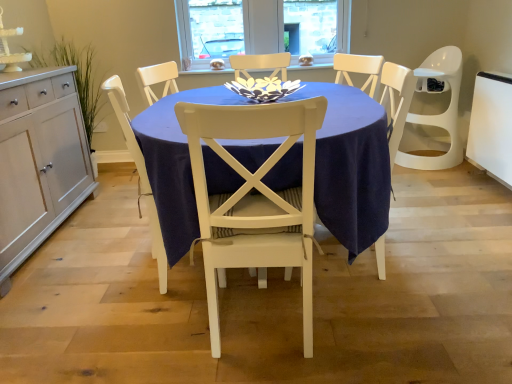
What is the approximate width of white painted wood chair at center, the first chair positioned from the right?

white painted wood chair at center, the first chair positioned from the right, is 21.41 inches in width.

In order to face white painted wood chair at center, the first chair positioned from the right, should I rotate leftwards or rightwards?

Turn left approximately 0.170 degrees to face it.

The height and width of the screenshot is (384, 512). What do you see at coordinates (139, 173) in the screenshot? I see `white wood chair at center, acting as the first chair starting from the left` at bounding box center [139, 173].

What do you see at coordinates (39, 161) in the screenshot? I see `white wood cabinet at left` at bounding box center [39, 161].

Find the location of `white painted wood chair at center, which is counted as the 2th chair, starting from the left`. white painted wood chair at center, which is counted as the 2th chair, starting from the left is located at coordinates (255, 197).

From a real-world perspective, is white painted wood chair at center, the first chair positioned from the right, below navy blue fabric table at center?

No, from a real-world perspective, white painted wood chair at center, the first chair positioned from the right, is not below navy blue fabric table at center.

Based on the photo, in the image, is white painted wood chair at center, the first chair positioned from the right, on the left side or the right side of navy blue fabric table at center?

white painted wood chair at center, the first chair positioned from the right, is positioned on navy blue fabric table at center's left side.

Does white painted wood chair at center, which is counted as the 2th chair, starting from the left, have a lesser height compared to navy blue fabric table at center?

No, white painted wood chair at center, which is counted as the 2th chair, starting from the left, is not shorter than navy blue fabric table at center.

Does white painted wood chair at center, the first chair positioned from the right, have a smaller size compared to navy blue fabric table at center?

Correct, white painted wood chair at center, the first chair positioned from the right, occupies less space than navy blue fabric table at center.

Is white painted wood chair at center, which is counted as the 2th chair, starting from the left, not near white wood chair at center, acting as the first chair starting from the left?

white painted wood chair at center, which is counted as the 2th chair, starting from the left, is actually quite close to white wood chair at center, acting as the first chair starting from the left.

Is white painted wood chair at center, the first chair positioned from the right, bigger or smaller than white wood chair at center, positioned as the second chair in right-to-left order?

Clearly, white painted wood chair at center, the first chair positioned from the right, is larger in size than white wood chair at center, positioned as the second chair in right-to-left order.

From a real-world perspective, is white painted wood chair at center, which is counted as the 2th chair, starting from the left, physically below white wood chair at center, acting as the first chair starting from the left?

Actually, white painted wood chair at center, which is counted as the 2th chair, starting from the left, is physically above white wood chair at center, acting as the first chair starting from the left, in the real world.

How far apart are white painted wood chair at center, which is counted as the 2th chair, starting from the left, and white wood chair at center, acting as the first chair starting from the left?

white painted wood chair at center, which is counted as the 2th chair, starting from the left, is 18.66 inches from white wood chair at center, acting as the first chair starting from the left.

Which object is closer to the camera, white wood chair at center, positioned as the second chair in right-to-left order, or white painted wood chair at center, which is counted as the 2th chair, starting from the left?

white painted wood chair at center, which is counted as the 2th chair, starting from the left.

Measure the distance from white wood chair at center, acting as the first chair starting from the left, to white painted wood chair at center, the first chair positioned from the right.

They are 18.66 inches apart.

Could you tell me if white wood chair at center, positioned as the second chair in right-to-left order, is facing white painted wood chair at center, which is counted as the 2th chair, starting from the left?

No, white wood chair at center, positioned as the second chair in right-to-left order, does not turn towards white painted wood chair at center, which is counted as the 2th chair, starting from the left.

Where is `chair on the right of white wood chair at center, positioned as the second chair in right-to-left order`? chair on the right of white wood chair at center, positioned as the second chair in right-to-left order is located at coordinates (255, 197).

Considering the relative sizes of white wood chair at center, positioned as the second chair in right-to-left order, and white wood cabinet at left in the image provided, is white wood chair at center, positioned as the second chair in right-to-left order, shorter than white wood cabinet at left?

No.

How many degrees apart are the facing directions of white wood chair at center, acting as the first chair starting from the left, and white wood cabinet at left?

The facing directions of white wood chair at center, acting as the first chair starting from the left, and white wood cabinet at left are 14.5 degrees apart.

Is white wood chair at center, positioned as the second chair in right-to-left order, smaller than white wood cabinet at left?

Indeed, white wood chair at center, positioned as the second chair in right-to-left order, has a smaller size compared to white wood cabinet at left.

Measure the distance between navy blue fabric table at center and white painted wood chair at center, which is counted as the 2th chair, starting from the left.

They are 10.53 inches apart.

Is navy blue fabric table at center taller than white painted wood chair at center, which is counted as the 2th chair, starting from the left?

No.

Which is more to the right, navy blue fabric table at center or white painted wood chair at center, the first chair positioned from the right?

navy blue fabric table at center.

Does point (379, 129) come in front of point (280, 119)?

No.

Is navy blue fabric table at center not inside white wood cabinet at left?

Yes, navy blue fabric table at center is not within white wood cabinet at left.

Is navy blue fabric table at center far away from white wood cabinet at left?

navy blue fabric table at center is far away from white wood cabinet at left.

Considering the points (258, 158) and (35, 179), which point is behind, point (258, 158) or point (35, 179)?

The point (35, 179) is behind.

In terms of height, does navy blue fabric table at center look taller or shorter compared to white wood cabinet at left?

navy blue fabric table at center is shorter than white wood cabinet at left.

Can you see white wood cabinet at left touching navy blue fabric table at center?

There is a gap between white wood cabinet at left and navy blue fabric table at center.

How many degrees apart are the facing directions of white wood cabinet at left and navy blue fabric table at center?

90.5 degrees separate the facing orientations of white wood cabinet at left and navy blue fabric table at center.

Could you tell me if white wood cabinet at left is facing navy blue fabric table at center?

Yes, white wood cabinet at left is turned towards navy blue fabric table at center.

Does point (45, 188) come behind point (177, 199)?

Yes.

Locate an element on the screen. This screenshot has height=384, width=512. chair that is the 1st object to the left of the navy blue fabric table at center, starting at the anchor is located at coordinates (255, 197).

You are a GUI agent. You are given a task and a screenshot of the screen. Output one action in this format:
    pyautogui.click(x=<x>, y=<y>)
    Task: Click on the chair below the white painted wood chair at center, the first chair positioned from the right (from a real-world perspective)
    The width and height of the screenshot is (512, 384).
    Given the screenshot: What is the action you would take?
    pyautogui.click(x=139, y=173)

Looking at the image, which one is located further to white wood chair at center, positioned as the second chair in right-to-left order, navy blue fabric table at center or white wood cabinet at left?

The object further to white wood chair at center, positioned as the second chair in right-to-left order, is white wood cabinet at left.

Looking at the image, which one is located further to navy blue fabric table at center, white wood cabinet at left or white painted wood chair at center, which is counted as the 2th chair, starting from the left?

Among the two, white wood cabinet at left is located further to navy blue fabric table at center.

Estimate the real-world distances between objects in this image. Which object is closer to white wood cabinet at left, navy blue fabric table at center or white painted wood chair at center, the first chair positioned from the right?

The object closer to white wood cabinet at left is navy blue fabric table at center.

Looking at the image, which one is located closer to white wood cabinet at left, white painted wood chair at center, the first chair positioned from the right, or white wood chair at center, acting as the first chair starting from the left?

Based on the image, white wood chair at center, acting as the first chair starting from the left, appears to be nearer to white wood cabinet at left.

Based on their spatial positions, is white painted wood chair at center, the first chair positioned from the right, or navy blue fabric table at center closer to white wood chair at center, acting as the first chair starting from the left?

Among the two, white painted wood chair at center, the first chair positioned from the right, is located nearer to white wood chair at center, acting as the first chair starting from the left.

Looking at the image, which one is located further to navy blue fabric table at center, white wood chair at center, positioned as the second chair in right-to-left order, or white wood cabinet at left?

Among the two, white wood cabinet at left is located further to navy blue fabric table at center.

Looking at the image, which one is located further to white wood chair at center, acting as the first chair starting from the left, white wood cabinet at left or navy blue fabric table at center?

white wood cabinet at left is positioned further to the anchor white wood chair at center, acting as the first chair starting from the left.

Looking at the image, which one is located further to white painted wood chair at center, which is counted as the 2th chair, starting from the left, navy blue fabric table at center or white wood chair at center, positioned as the second chair in right-to-left order?

The object further to white painted wood chair at center, which is counted as the 2th chair, starting from the left, is white wood chair at center, positioned as the second chair in right-to-left order.

Find the location of a particular element. The image size is (512, 384). chair between white wood cabinet at left and white painted wood chair at center, which is counted as the 2th chair, starting from the left, from left to right is located at coordinates (139, 173).

Find the location of `chair between white wood chair at center, positioned as the second chair in right-to-left order, and navy blue fabric table at center`. chair between white wood chair at center, positioned as the second chair in right-to-left order, and navy blue fabric table at center is located at coordinates (255, 197).